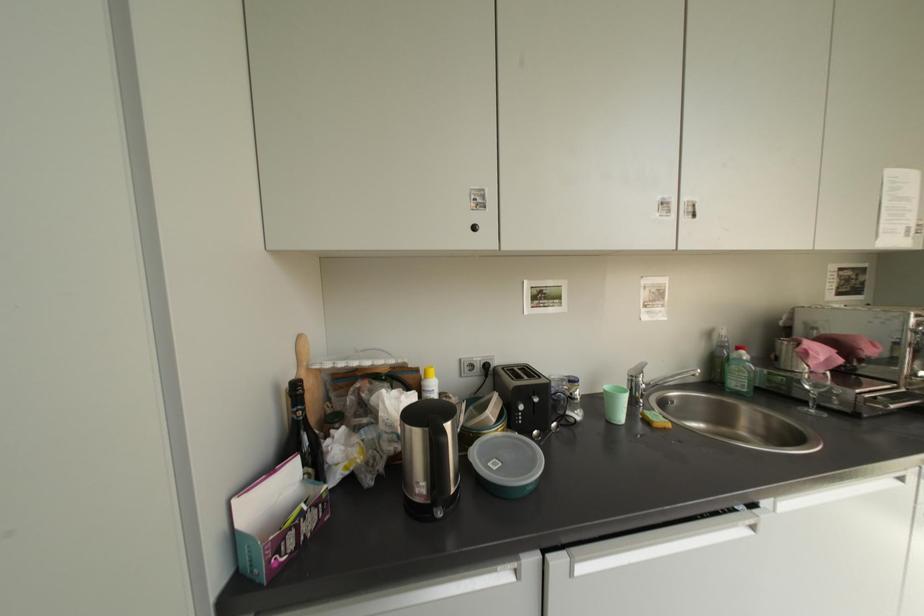
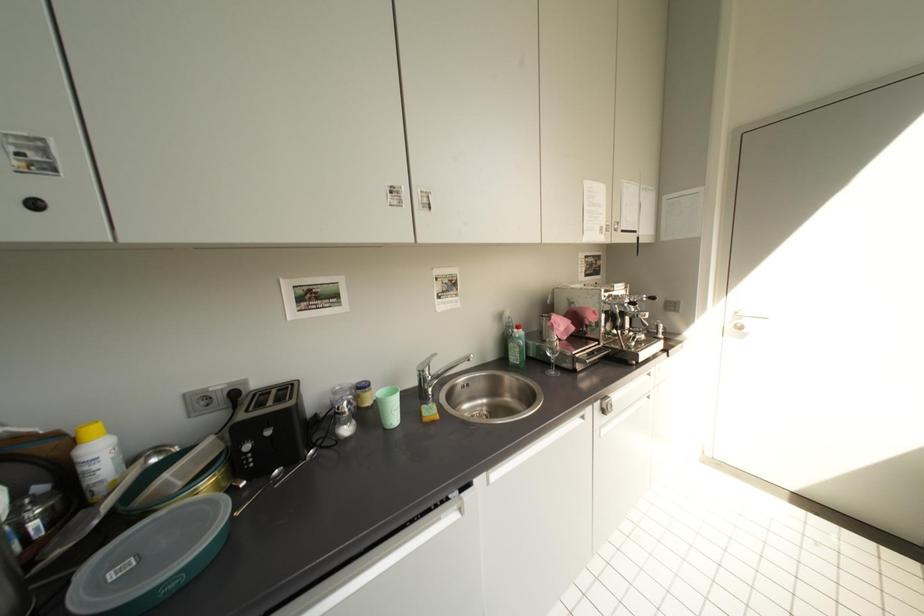
Question: The images are taken continuously from a first-person perspective. In which direction are you moving?

Choices:
 (A) Left
 (B) Right
 (C) Forward
 (D) Backward

Answer: (B)